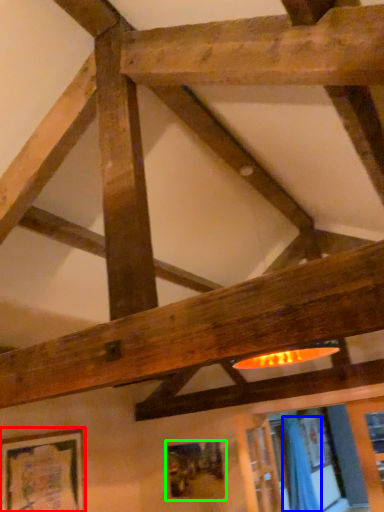
Question: Based on their relative distances, which object is farther from picture frame (highlighted by a red box)? Choose from curtain (highlighted by a blue box) and picture frame (highlighted by a green box).

Choices:
 (A) curtain
 (B) picture frame

Answer: (A)